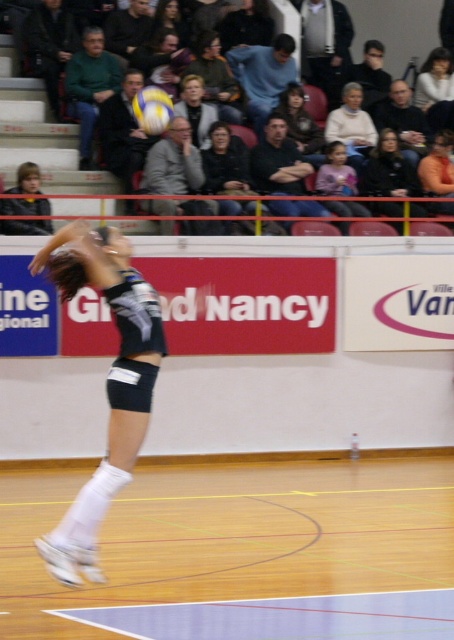
Between point (366, 513) and point (294, 113), which one is positioned in front?

Positioned in front is point (366, 513).

Is point (339, 577) positioned behind point (301, 99)?

No.

Which is in front, point (324, 552) or point (299, 116)?

Point (324, 552)

Locate an element on the screen. The height and width of the screenshot is (640, 454). wooden floor at center is located at coordinates (232, 536).

Who is positioned more to the right, orange fabric shirt at upper right or smooth white blouse at upper center?

smooth white blouse at upper center is more to the right.

In the scene shown: Between orange fabric shirt at upper right and smooth white blouse at upper center, which one is positioned lower?

Positioned lower is orange fabric shirt at upper right.

Does point (453, 196) come farther from viewer compared to point (429, 86)?

No, it is not.

At what (x,y) coordinates should I click in order to perform the action: click on orange fabric shirt at upper right. Please return your answer as a coordinate pair (x, y). This screenshot has height=640, width=454. Looking at the image, I should click on (438, 166).

Can you confirm if pink fabric shirt at center is taller than orange fabric shirt at upper right?

Yes.

Find the location of `pink fabric shirt at center`. pink fabric shirt at center is located at coordinates (335, 172).

What are the coordinates of `pink fabric shirt at center` in the screenshot? It's located at (335, 172).